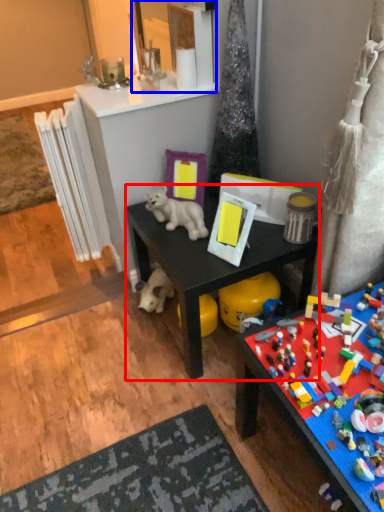
Question: Which point is further to the camera, desk (highlighted by a red box) or mirror (highlighted by a blue box)?

Choices:
 (A) desk
 (B) mirror

Answer: (B)